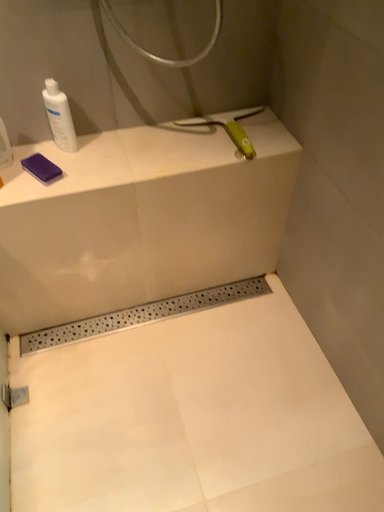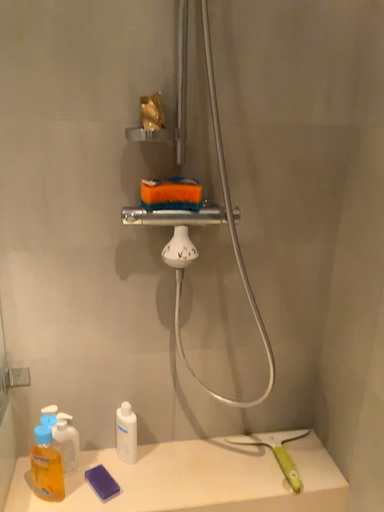
Question: How did the camera likely rotate when shooting the video?

Choices:
 (A) rotated downward
 (B) rotated upward

Answer: (B)